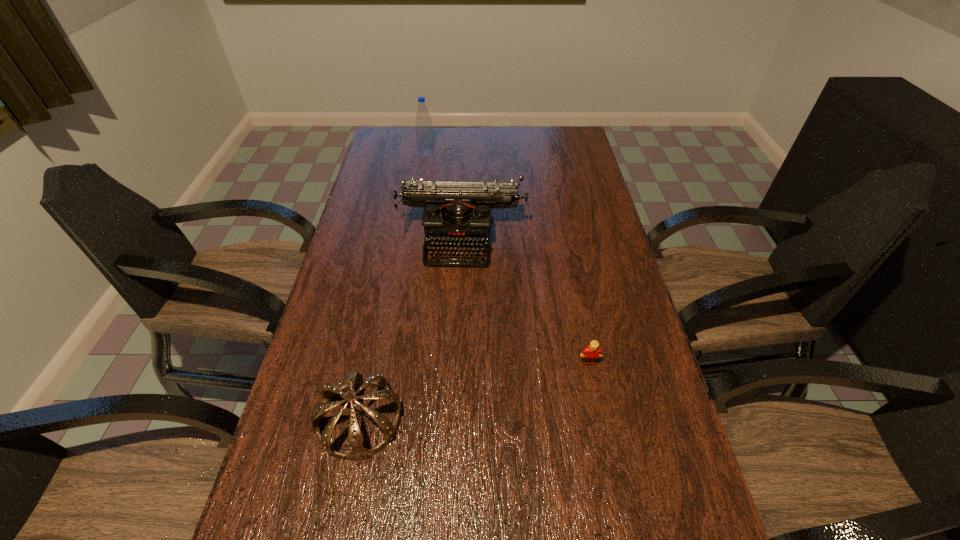
What are the coordinates of `free space located 0.060m on the front of the nearest object` in the screenshot? It's located at (346, 495).

You are a GUI agent. You are given a task and a screenshot of the screen. Output one action in this format:
    pyautogui.click(x=<x>, y=<y>)
    Task: Click on the free spot located on the face of the shortest object
    
    Given the screenshot: What is the action you would take?
    pyautogui.click(x=602, y=427)

You are a GUI agent. You are given a task and a screenshot of the screen. Output one action in this format:
    pyautogui.click(x=<x>, y=<y>)
    Task: Click on the object present at the far edge
    
    Given the screenshot: What is the action you would take?
    pyautogui.click(x=425, y=142)

At what (x,y) coordinates should I click in order to perform the action: click on typewriter situated at the left edge. Please return your answer as a coordinate pair (x, y). This screenshot has height=540, width=960. Looking at the image, I should click on (456, 214).

I want to click on tiara that is at the left edge, so click(x=330, y=392).

The height and width of the screenshot is (540, 960). What are the coordinates of `object located at the right edge` in the screenshot? It's located at coord(590,354).

The image size is (960, 540). In order to click on vacant space at the far edge in this screenshot , I will do `click(475, 151)`.

Identify the location of free space at the left edge. Image resolution: width=960 pixels, height=540 pixels. (372, 169).

The image size is (960, 540). In order to click on free spot at the right edge of the desktop in this screenshot , I will do `click(568, 230)`.

Image resolution: width=960 pixels, height=540 pixels. In the image, there is a desktop. What are the coordinates of `vacant space at the far left corner` in the screenshot? It's located at (409, 131).